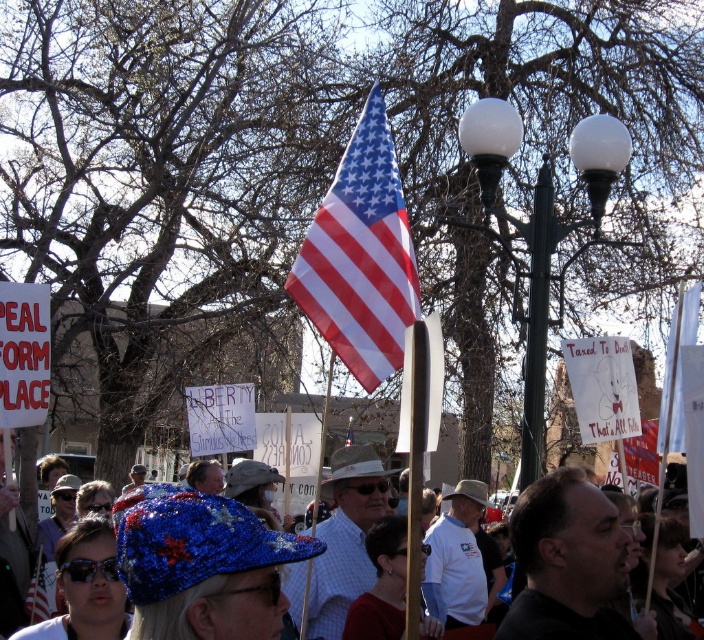
In the scene shown: Who is lower down, sequined fabric hat at center or red fabric flag at center?

sequined fabric hat at center

Is point (94, 563) behind point (643, 426)?

No.

Is point (270, 582) positioned before point (643, 435)?

Yes, point (270, 582) is closer to viewer.

Find the location of a particular element. The image size is (704, 640). sequined fabric hat at center is located at coordinates (191, 548).

Is sequined fabric hat at center smaller than green metal lamp post at upper center?

No.

Is sequined fabric hat at center taller than green metal lamp post at upper center?

No, sequined fabric hat at center is not taller than green metal lamp post at upper center.

Does point (196, 547) come behind point (463, 147)?

No, it is not.

Where is `sequined fabric hat at center`? Image resolution: width=704 pixels, height=640 pixels. sequined fabric hat at center is located at coordinates (191, 548).

Between american flag at center and red fabric flag at center, which one appears on the right side from the viewer's perspective?

red fabric flag at center

Identify the location of american flag at center. (x=360, y=257).

The image size is (704, 640). Identify the location of american flag at center. (360, 257).